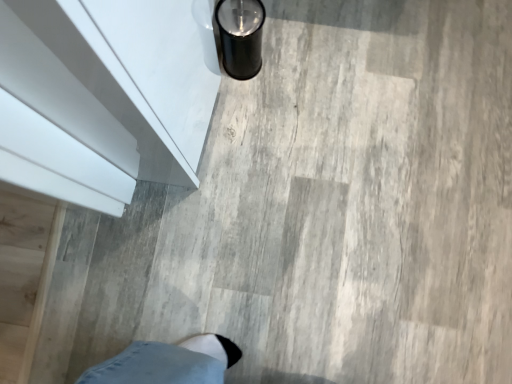
This screenshot has height=384, width=512. What do you see at coordinates (239, 36) in the screenshot? I see `black matte shoe at lower center` at bounding box center [239, 36].

At what (x,y) coordinates should I click in order to perform the action: click on black matte shoe at lower center. Please return your answer as a coordinate pair (x, y). Looking at the image, I should click on (239, 36).

At what (x,y) coordinates should I click in order to perform the action: click on black matte shoe at lower center. Please return your answer as a coordinate pair (x, y). The height and width of the screenshot is (384, 512). Looking at the image, I should click on (239, 36).